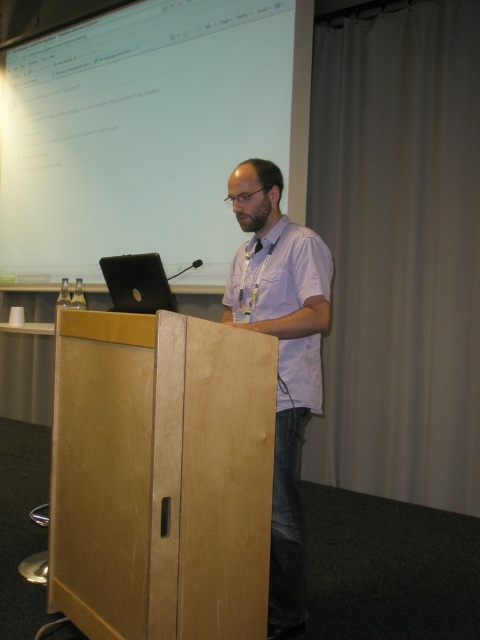
Can you confirm if white glossy projection screen at upper center is wider than white shirt at center?

Yes, white glossy projection screen at upper center is wider than white shirt at center.

Is point (106, 144) positioned in front of point (296, 440)?

That is False.

Does point (84, 198) lie behind point (301, 330)?

Yes.

Find the location of a particular element. This screenshot has width=480, height=640. white glossy projection screen at upper center is located at coordinates (140, 134).

Is white shirt at center positioned at the back of satin black laptop at center?

No, white shirt at center is closer to the viewer.

This screenshot has height=640, width=480. Identify the location of white shirt at center. (282, 356).

Is white glossy projection screen at upper center further to the viewer compared to white cotton shirt at center?

Yes.

Is point (34, 54) in front of point (300, 262)?

No.

This screenshot has width=480, height=640. Identify the location of white glossy projection screen at upper center. (140, 134).

Image resolution: width=480 pixels, height=640 pixels. I want to click on white glossy projection screen at upper center, so click(140, 134).